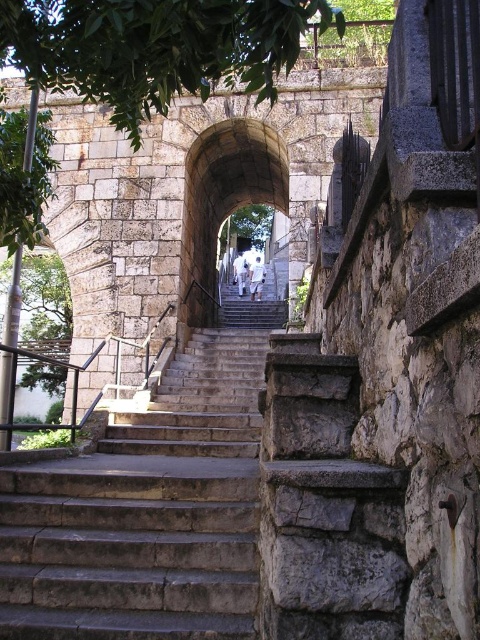
You are standing at the base of the stone staircase and want to take a photo that includes both the point at coordinates (132, 600) and the point at (291, 52). Which point will appear larger in the photo?

Point (132, 600) is closer to the camera than point (291, 52), so it will appear larger in the photo.

You are standing at the bottom of the stone stairs at center and want to reach the green leafy tree at center. Which direction should you move?

You should move upward along the stone stairs at center to reach the green leafy tree at center since the stone stairs at center is below the green leafy tree at center.

You are standing at the bottom of the stone stairs at center and want to reach the archway above. Which direction should you look to see the green leafy tree at left?

The stone stairs at center are positioned under the green leafy tree at left, so you should look upward and to the left to see the green leafy tree at left.